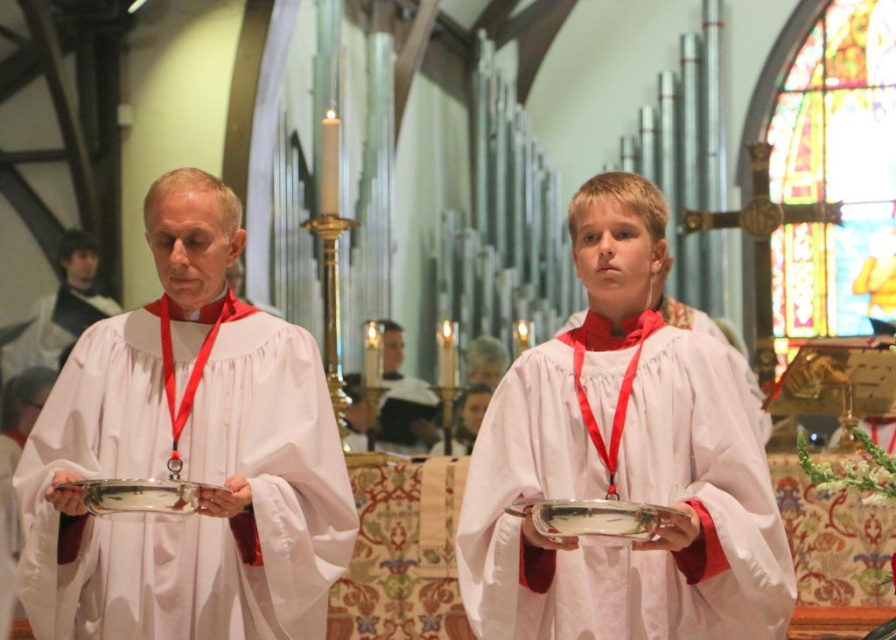
Question: Which point is closer to the camera?

Choices:
 (A) silver metallic tray at center
 (B) white matte robe at left

Answer: (A)

Question: Does smooth white robe at center have a greater width compared to silver metallic tray at center?

Choices:
 (A) yes
 (B) no

Answer: (A)

Question: Among these points, which one is farthest from the camera?

Choices:
 (A) (401, 380)
 (B) (131, 481)

Answer: (A)

Question: Where is white matte robe at center located in relation to silver metallic tray at center in the image?

Choices:
 (A) left
 (B) right

Answer: (B)

Question: Does white cotton robe at left have a lesser width compared to smooth white robe at center?

Choices:
 (A) yes
 (B) no

Answer: (A)

Question: Estimate the real-world distances between objects in this image. Which object is farther from the white cotton robe at left?

Choices:
 (A) white matte robe at center
 (B) silver metallic platter at center
 (C) silver metallic tray at center

Answer: (B)